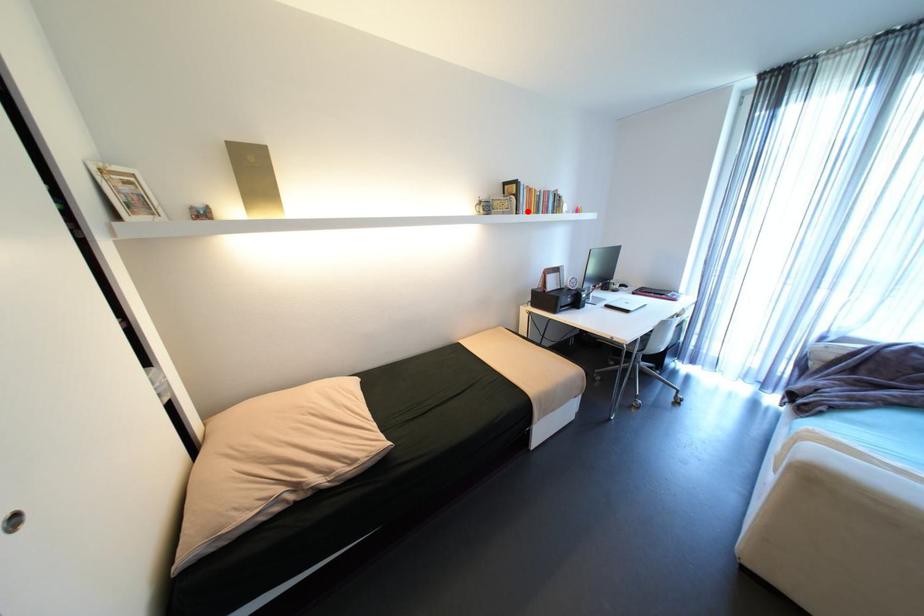
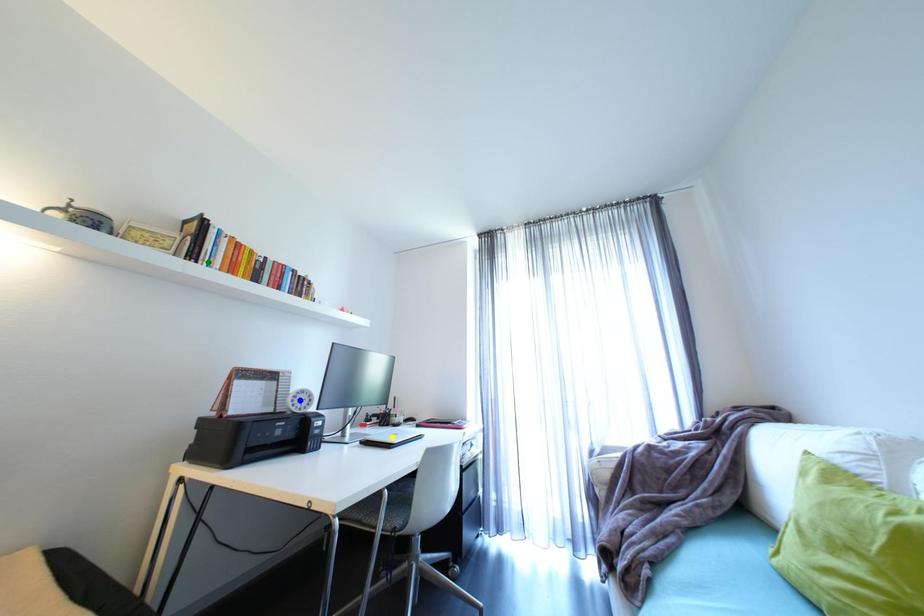
Question: I am providing you with two images of the same scene from different viewpoints. A red point is marked on the first image. You are given multiple points on the second image. Which point in image 2 is actually the same real-world point as the red point in image 1?

Choices:
 (A) blue point
 (B) green point
 (C) yellow point

Answer: (B)